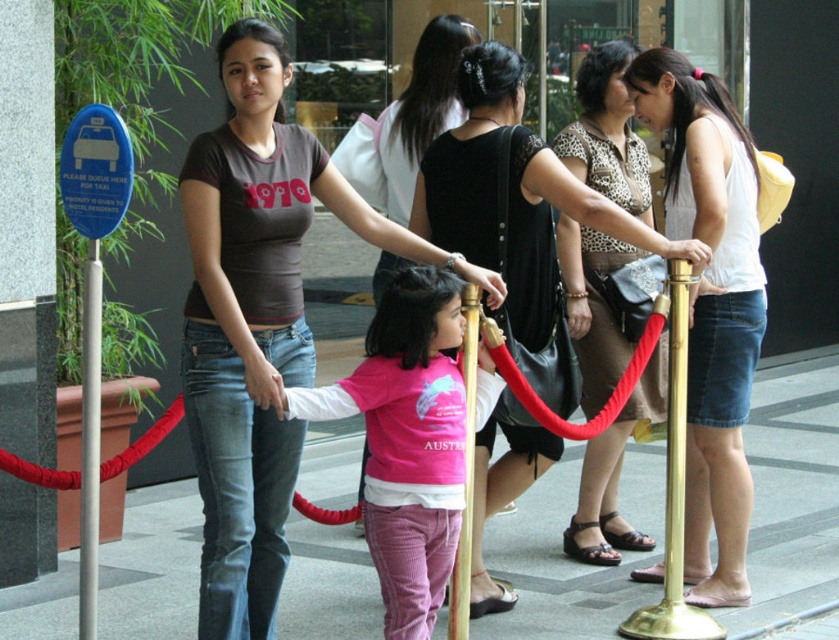
You are a pedestrian trying to join the taxi queue. You see the gold metallic pole at center and the matte pink shirt at center. Which object is closer to the left side of the frame?

The matte pink shirt at center is closer to the left side of the frame because the gold metallic pole at center is positioned to its right.

You are a photographer trying to capture a candid shot of the leopard print blouse at center without being too obvious. If your camera has a maximum effective range of 20 feet, can you take the photo from where you are standing?

The leopard print blouse at center and camera are 20.34 feet apart, which exceeds the camera maximum effective range of 20 feet. Therefore, you cannot take the photo from where you are standing.

Looking at this image, you are a person standing at the center of the taxi queue. There is a leopard print blouse at center and a matte pink shirt at center in front of you. How far apart are these two items?

The leopard print blouse at center is 7.40 feet away from the matte pink shirt at center.